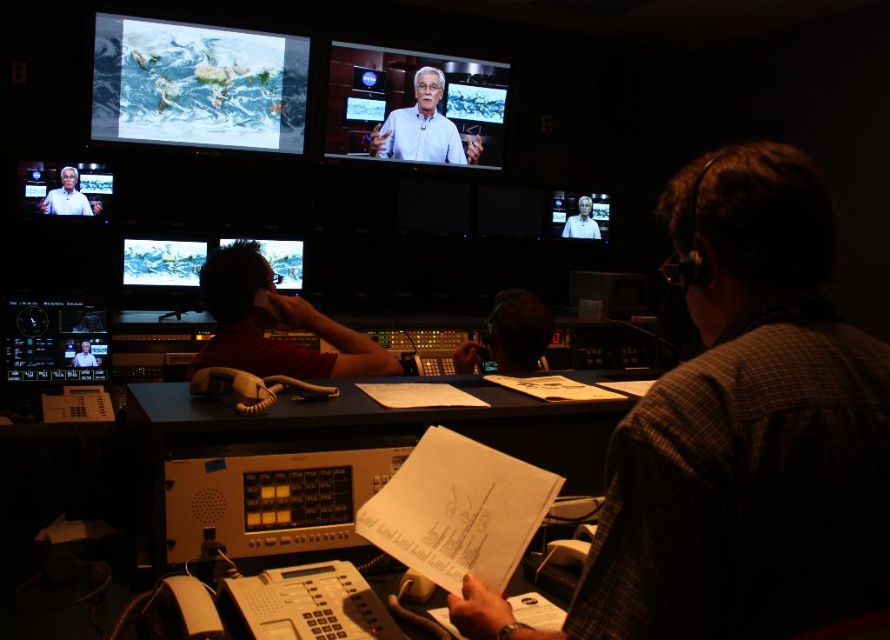
You are an astronaut in the control room and need to hand over a critical document to the person closest to you. Given the positions of the white shirt at upper center and the matte white shirt at upper left, which one should you approach?

The white shirt at upper center is closer to you, so you should approach the white shirt at upper center to hand over the critical document.

You are an observer in the control room. You notice two people wearing white shirts. The first is the matte white shirt at upper left, and the second is the white shirt at upper center. Which one is positioned to the right of the other?

The white shirt at upper center is positioned to the right of the matte white shirt at upper left.

You are an astronaut in the control room and need to identify which crew member is closer to you. You see the light blue fabric shirt at center and the light blue shirt at upper center. Which one is closer to you?

The light blue fabric shirt at center is closer to you because it is in front of the light blue shirt at upper center.